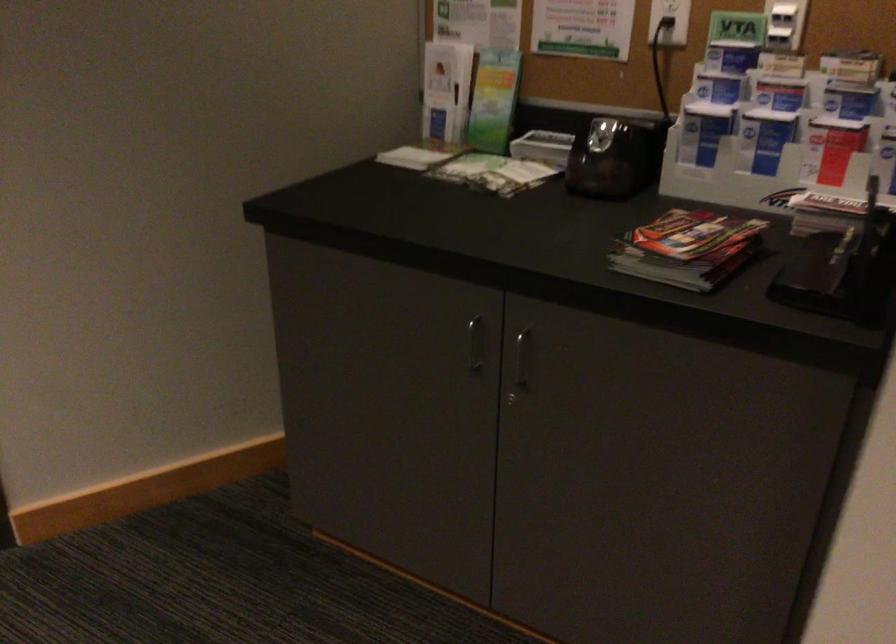
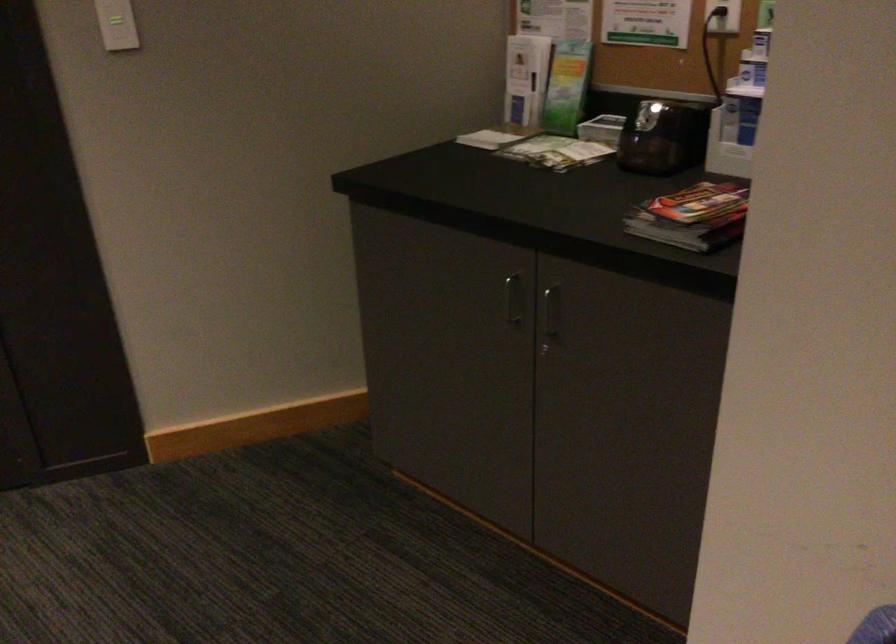
Which direction would the cameraman need to move to produce the second image?

The cameraman walked toward right, backward.